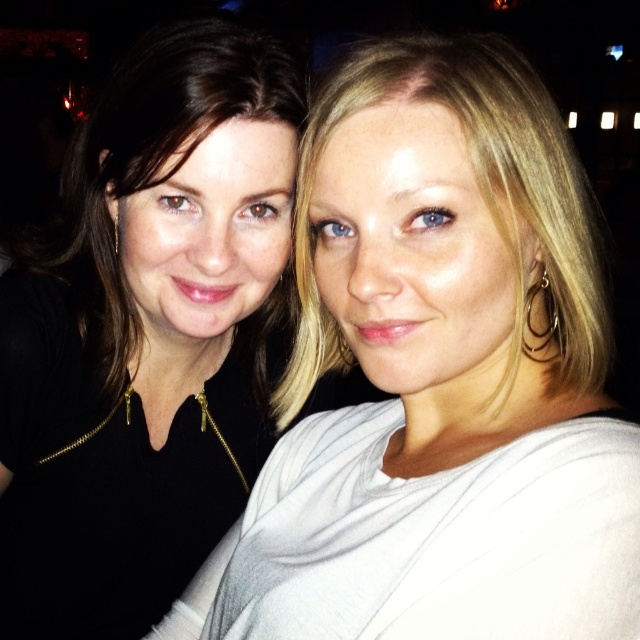
You are a photographer trying to adjust the lighting for a group photo. You notice the white matte shirt at upper right and the matte black top at upper left. Which clothing item might require more light to ensure proper exposure?

The white matte shirt at upper right might require more light to ensure proper exposure because white clothing typically reflects more light than black clothing, and since it might be wider, it could cover a larger area needing adequate illumination.

You are a photographer trying to adjust the lighting for a group photo. You notice the matte black top at left and the white matte shirt at upper right. Which clothing item might require more light to ensure it doesn not appear too dark in the photo?

The matte black top at left might require more light because dark colors absorb more light and can appear darker in photos, so adding more light can help balance the exposure between the matte black top at left and the white matte shirt at upper right.

Based on the photo, you are taking a photo of two friends standing at point (230, 589). The camera you are using has a minimum focus distance of 30 inches. Will the camera be able to focus on them clearly?

The distance between point (230, 589) and the camera is 28.48 inches, which is less than the camera minimum focus distance of 30 inches. Therefore, the camera will not be able to focus on them clearly.